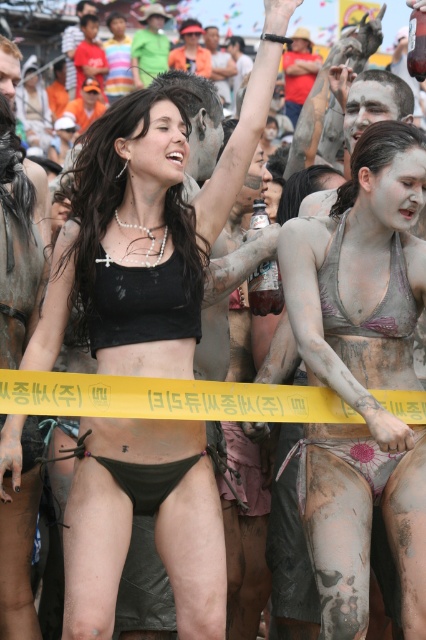
You are a photographer at the mud festival. You want to take a photo of both the matte pink bikini at center and the purple metallic bikini top at center. However, you can only focus on one of them. Which one should you choose to ensure the other is still visible in the background?

You should focus on the matte pink bikini at center because it is in front of the purple metallic bikini top at center, so the purple metallic bikini top at center will still be visible in the background.

You are a photographer at the mud festival trying to capture a clear shot of both the matte pink bikini at center and the black matte bikini bottom at center. Which one is closer to the camera?

The matte pink bikini at center is positioned under the black matte bikini bottom at center, so the black matte bikini bottom at center is closer to the camera.